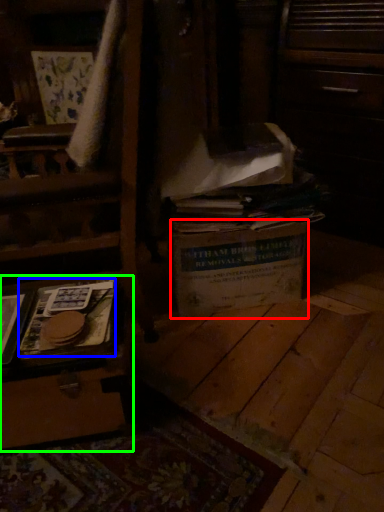
Question: Which object is the closest to the cardboard box (highlighted by a red box)? Choose among these: paperback book (highlighted by a blue box) or vanity (highlighted by a green box).

Choices:
 (A) paperback book
 (B) vanity

Answer: (A)